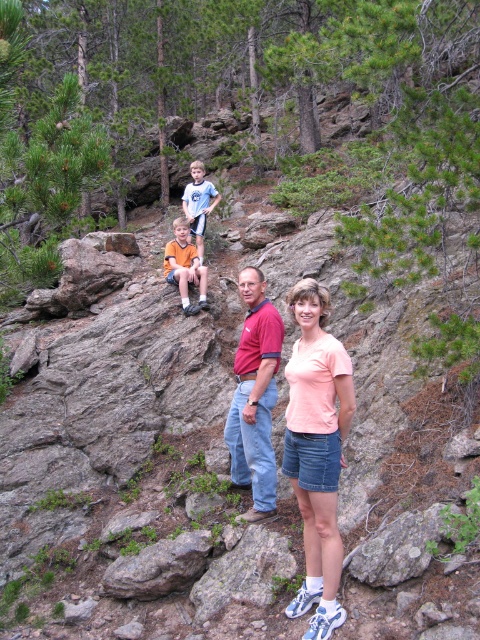
Does point (196, 266) come closer to viewer compared to point (202, 230)?

That is True.

Which is below, orange cotton shirt at center or light blue t-shirt at center?

orange cotton shirt at center

Who is more forward, (180, 298) or (193, 211)?

Point (180, 298) is in front.

Locate an element on the screen. orange cotton shirt at center is located at coordinates (184, 266).

From the picture: Between pink cotton t-shirt at center and orange cotton shirt at center, which one is positioned lower?

pink cotton t-shirt at center is lower down.

Can you confirm if pink cotton t-shirt at center is positioned to the right of orange cotton shirt at center?

Yes, pink cotton t-shirt at center is to the right of orange cotton shirt at center.

Is point (327, 634) farther from camera compared to point (192, 257)?

No, it is not.

Where is `pink cotton t-shirt at center`? This screenshot has height=640, width=480. pink cotton t-shirt at center is located at coordinates coord(316,451).

Is red cotton polo shirt at center bigger than orange cotton shirt at center?

No.

Who is higher up, red cotton polo shirt at center or orange cotton shirt at center?

Positioned higher is orange cotton shirt at center.

I want to click on red cotton polo shirt at center, so click(254, 396).